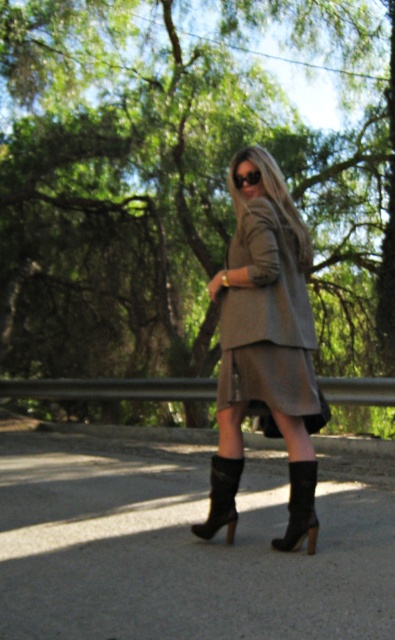
Which of these two, matte gray coat at center or black suede boot at lower center, stands shorter?

black suede boot at lower center

Which is above, matte gray coat at center or black suede boot at lower center?

matte gray coat at center is above.

Is point (257, 323) less distant than point (282, 540)?

Yes, it is.

This screenshot has width=395, height=640. What are the coordinates of `matte gray coat at center` in the screenshot? It's located at (265, 348).

Which is behind, point (272, 241) or point (242, 172)?

The point (242, 172) is behind.

Is matte gray dress at center above matte black sunglasses at center?

No, matte gray dress at center is not above matte black sunglasses at center.

Where is `matte gray dress at center`? This screenshot has width=395, height=640. matte gray dress at center is located at coordinates (267, 320).

You are a GUI agent. You are given a task and a screenshot of the screen. Output one action in this format:
    pyautogui.click(x=<x>, y=<y>)
    Task: Click on the matte gray dress at center
    
    Given the screenshot: What is the action you would take?
    pyautogui.click(x=267, y=320)

Does matte gray dress at center have a smaller size compared to black suede boot at lower center?

No, matte gray dress at center is not smaller than black suede boot at lower center.

Does point (276, 323) come in front of point (310, 474)?

No, it is behind (310, 474).

Locate an element on the screen. This screenshot has height=640, width=395. matte gray dress at center is located at coordinates (267, 320).